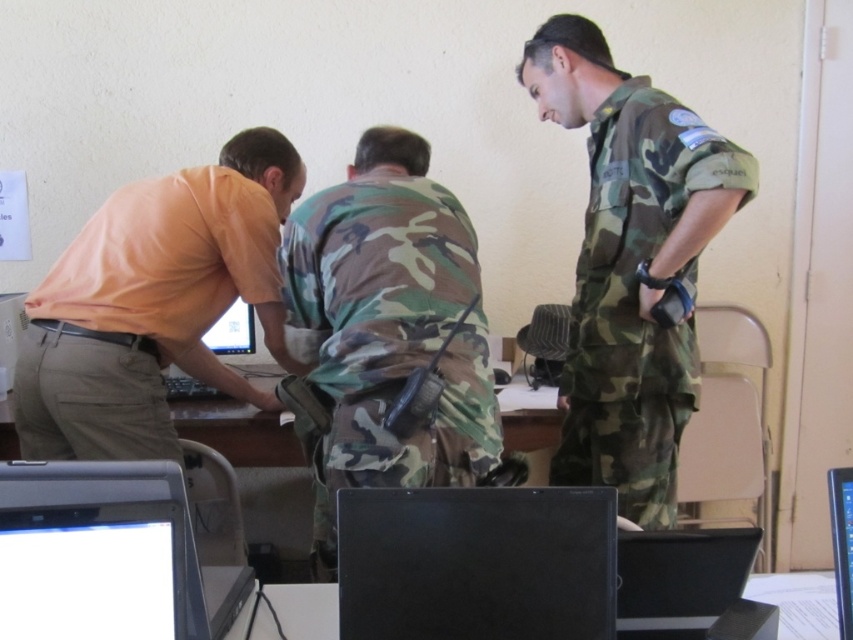
Does camo fabric uniform at right have a lesser height compared to matte white monitor at center?

In fact, camo fabric uniform at right may be taller than matte white monitor at center.

Who is more distant from viewer, (627, 339) or (218, 326)?

Positioned behind is point (218, 326).

Between point (605, 212) and point (248, 324), which one is positioned in front?

Point (605, 212)

Image resolution: width=853 pixels, height=640 pixels. I want to click on camo fabric uniform at right, so (637, 298).

Is black plastic table at lower center further to camera compared to matte white monitor at center?

No, black plastic table at lower center is closer to the viewer.

I want to click on black plastic table at lower center, so click(798, 602).

Does black glossy monitor at lower right have a lesser height compared to matte white monitor at center?

No.

Between black glossy monitor at lower right and matte white monitor at center, which one has more height?

Standing taller between the two is black glossy monitor at lower right.

Image resolution: width=853 pixels, height=640 pixels. In order to click on black glossy monitor at lower right in this screenshot , I will do `click(840, 544)`.

The image size is (853, 640). Identify the location of black glossy monitor at lower right. (840, 544).